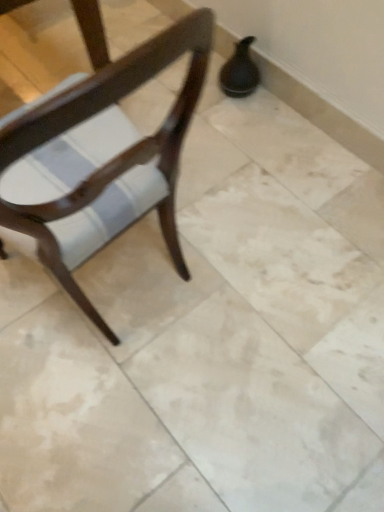
Identify the location of vacant space in wooden chair at center (from a real-world perspective). The width and height of the screenshot is (384, 512). (98, 282).